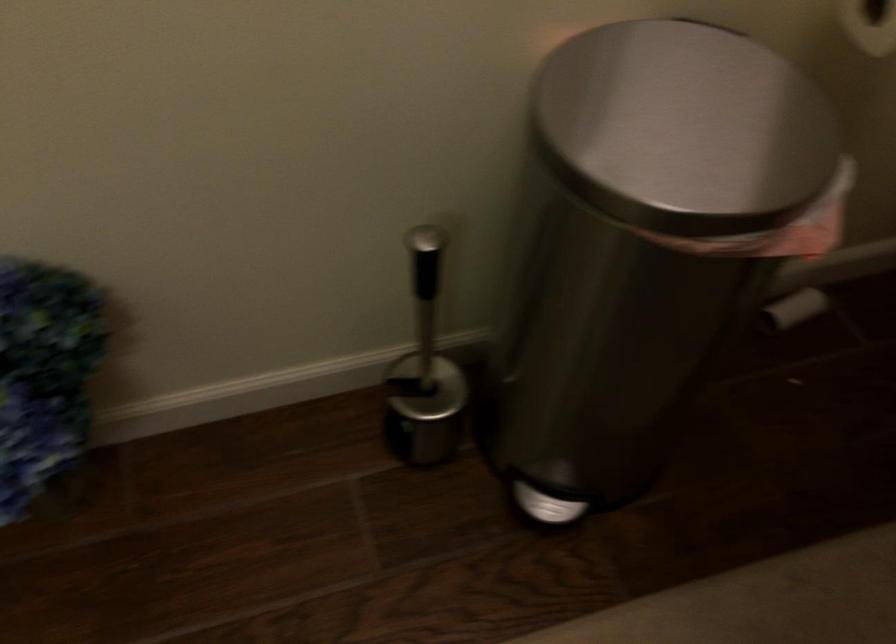
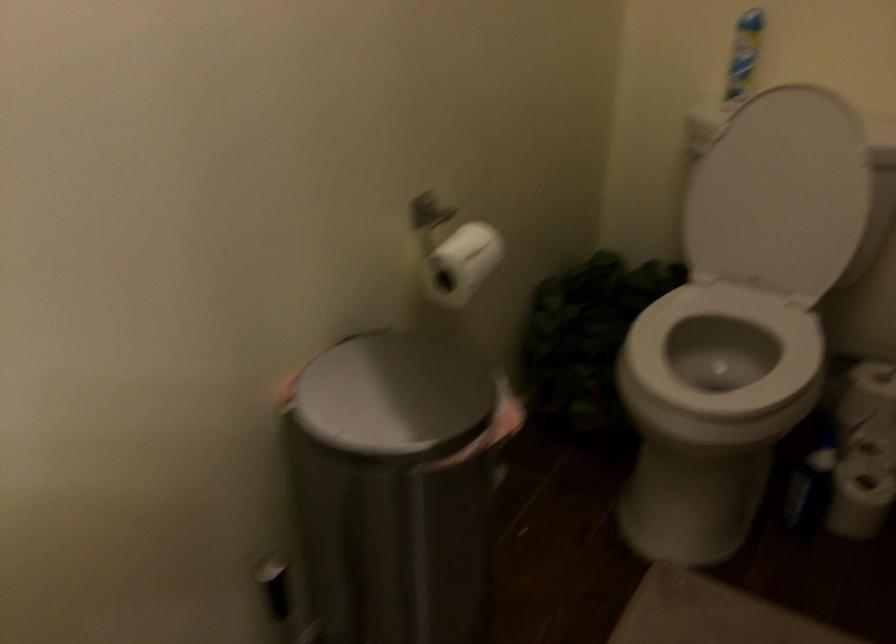
Question: The camera is either moving clockwise (left) or counter-clockwise (right) around the object. The first image is from the beginning of the video and the second image is from the end. Is the camera moving left or right when shooting the video?

Choices:
 (A) Left
 (B) Right

Answer: (A)